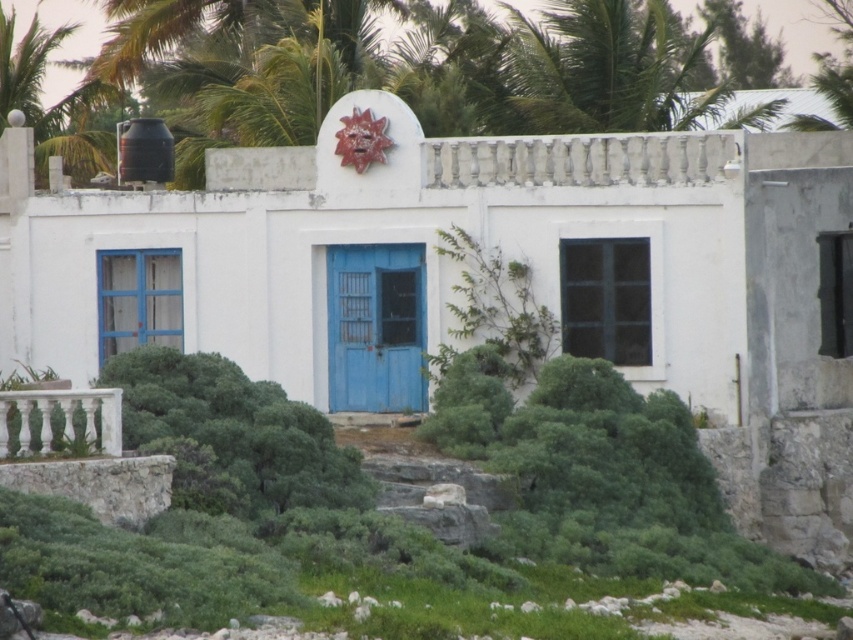
You are a visitor approaching the building and want to enter through the blue matte door at center. However, there is a green leafy bush at center blocking your path. Can you walk around the bush to reach the door?

The green leafy bush at center is positioned under the blue matte door at center, meaning the bush is directly in front of the door. Since the bush is under the door, it is likely blocking the entrance, so you cannot walk around it to reach the door.

You are standing in front of the small white building and want to enter through the blue matte door at center. However, there is a green leafy bush at center blocking your path. Can you walk around the bush to reach the door?

The green leafy bush at center is to the left of the blue matte door at center, so you can walk around to the right side of the bush to reach the door.

You are a painter who needs to decide which door to paint first. The blue matte door at center and the blue painted wood door at left are both in need of touchup. Considering their sizes, which door requires more paint?

The blue matte door at center requires more paint because its width surpasses that of the blue painted wood door at left, meaning it has a larger surface area.